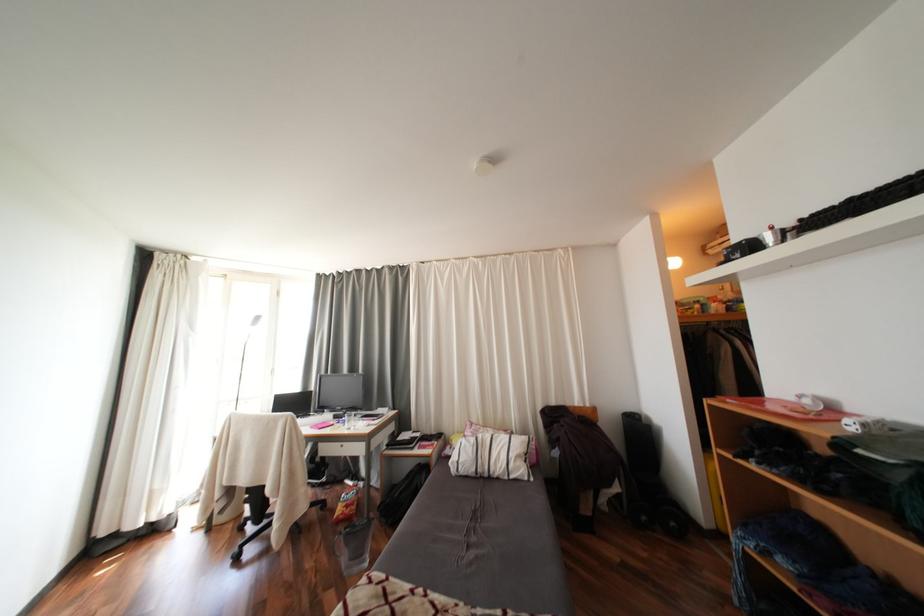
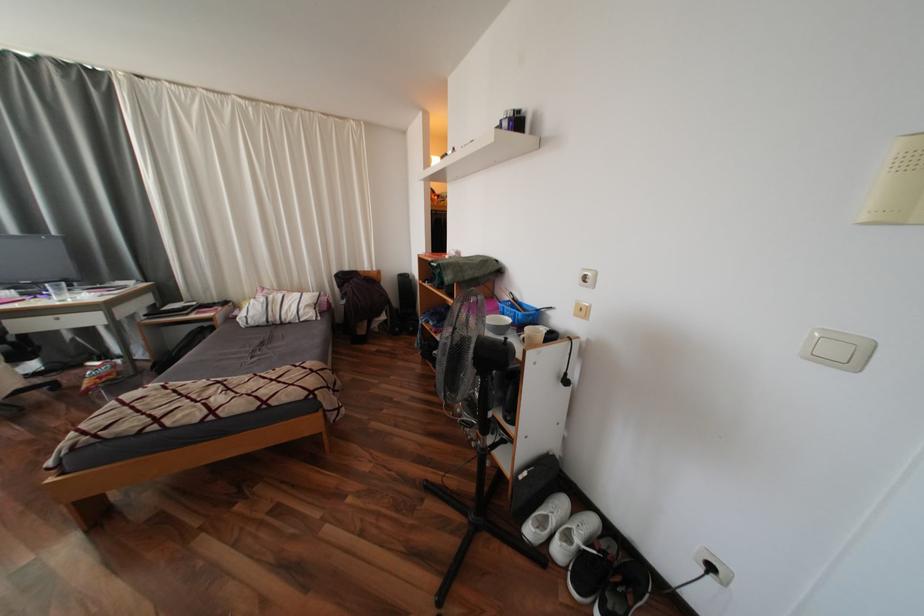
Based on the continuous images, in which direction is the camera rotating?

The camera's rotation is toward right-down.